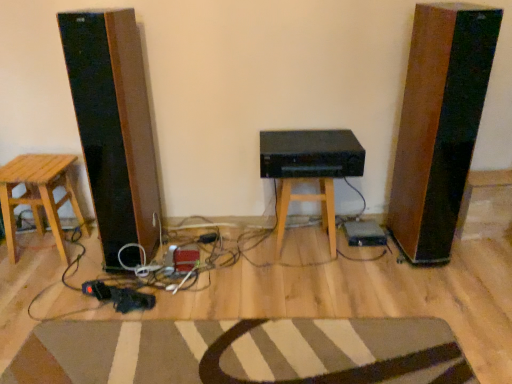
In order to click on vacant space underneath wooden stool at center, the second stool when ordered from left to right (from a real-world perspective) in this screenshot , I will do `click(302, 244)`.